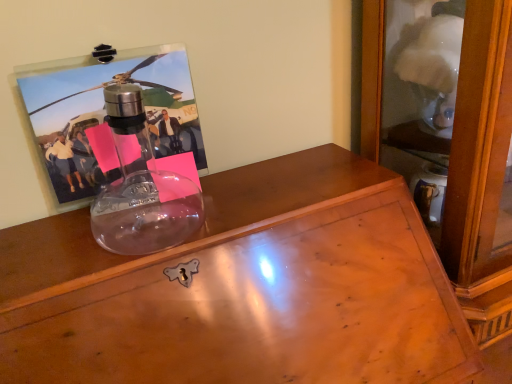
Question: Could you tell me if clear plastic frame at upper left is turned towards transparent glass desk at upper left?

Choices:
 (A) no
 (B) yes

Answer: (A)

Question: Can you confirm if clear plastic frame at upper left is taller than transparent glass desk at upper left?

Choices:
 (A) no
 (B) yes

Answer: (A)

Question: From a real-world perspective, is clear plastic frame at upper left located beneath transparent glass desk at upper left?

Choices:
 (A) yes
 (B) no

Answer: (B)

Question: From the image's perspective, is clear plastic frame at upper left under transparent glass desk at upper left?

Choices:
 (A) yes
 (B) no

Answer: (B)

Question: Can you confirm if clear plastic frame at upper left is shorter than transparent glass desk at upper left?

Choices:
 (A) yes
 (B) no

Answer: (A)

Question: Is the depth of clear plastic frame at upper left less than that of transparent glass desk at upper left?

Choices:
 (A) no
 (B) yes

Answer: (A)

Question: Can you confirm if transparent glass desk at upper left is taller than clear plastic frame at upper left?

Choices:
 (A) yes
 (B) no

Answer: (A)

Question: From a real-world perspective, is transparent glass desk at upper left located beneath clear plastic frame at upper left?

Choices:
 (A) no
 (B) yes

Answer: (B)

Question: Is the depth of transparent glass desk at upper left less than that of clear plastic frame at upper left?

Choices:
 (A) yes
 (B) no

Answer: (A)

Question: Can you confirm if transparent glass desk at upper left is bigger than clear plastic frame at upper left?

Choices:
 (A) no
 (B) yes

Answer: (B)

Question: Is transparent glass desk at upper left aimed at clear plastic frame at upper left?

Choices:
 (A) yes
 (B) no

Answer: (B)

Question: Is transparent glass desk at upper left positioned with its back to clear plastic frame at upper left?

Choices:
 (A) yes
 (B) no

Answer: (B)

Question: From their relative heights in the image, would you say clear plastic frame at upper left is taller or shorter than transparent glass desk at upper left?

Choices:
 (A) short
 (B) tall

Answer: (A)